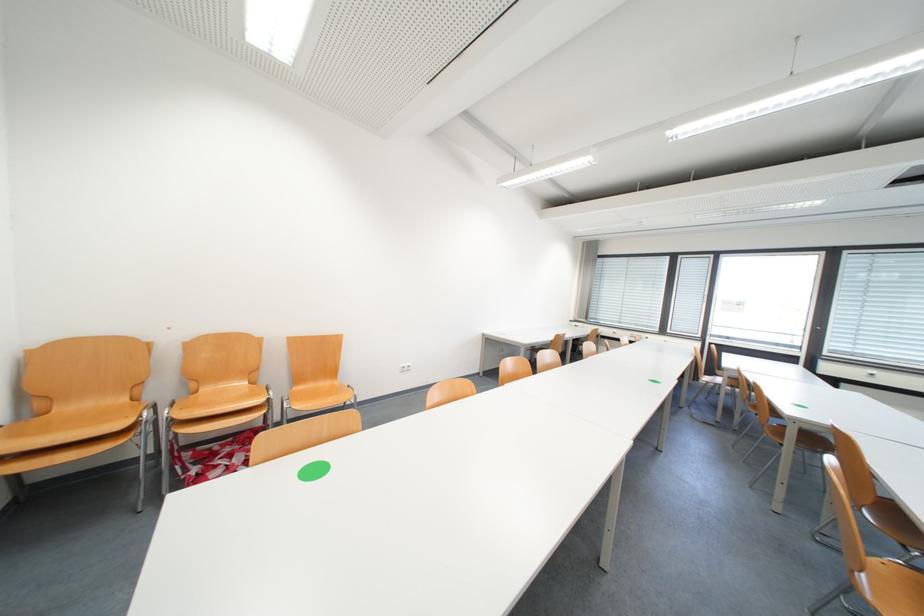
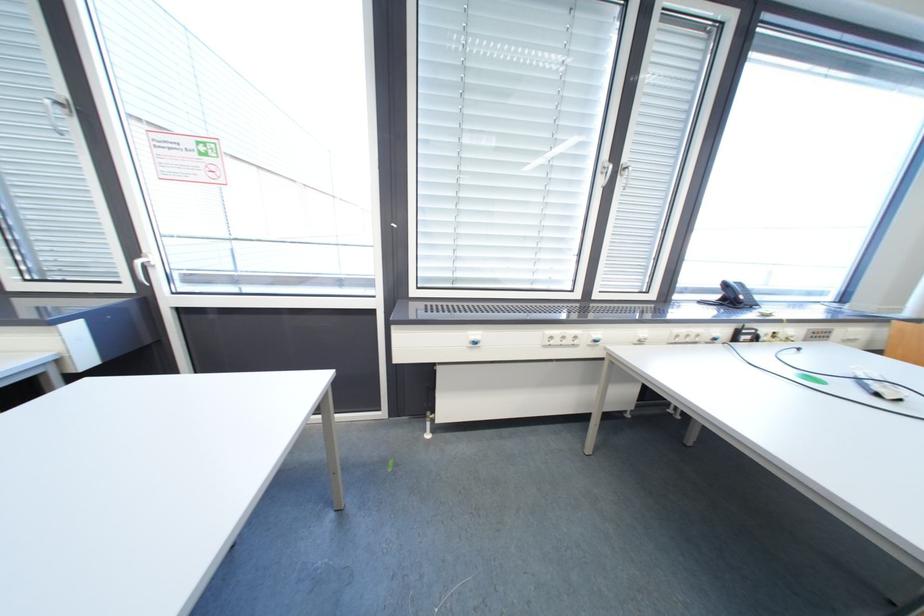
In the second image, find the point that corresponds to point 878,373 in the first image.

(480, 334)